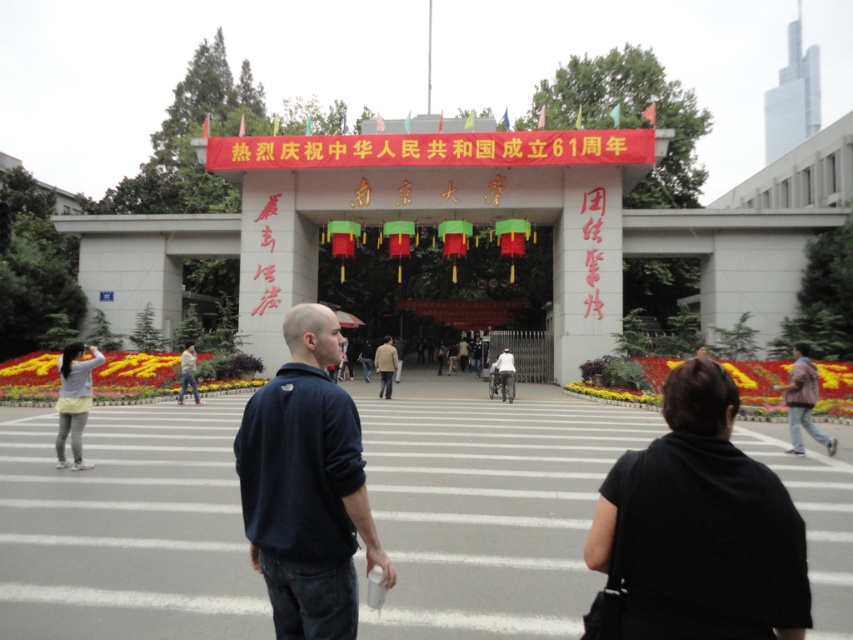
Question: Based on their relative distances, which object is nearer to the brown leather jacket at lower right?

Choices:
 (A) light brown leather jacket at center
 (B) dark blue fleece at center

Answer: (A)

Question: Which point appears closest to the camera in this image?

Choices:
 (A) (374, 362)
 (B) (329, 342)
 (C) (807, 400)

Answer: (B)

Question: Based on their relative distances, which object is farther from the light brown leather jacket at center?

Choices:
 (A) dark blue fleece at center
 (B) brown leather jacket at lower right

Answer: (A)

Question: Is dark blue fleece at center closer to the viewer compared to light brown leather jacket at center?

Choices:
 (A) yes
 (B) no

Answer: (A)

Question: Observing the image, what is the correct spatial positioning of dark blue fleece at center in reference to light brown leather jacket at center?

Choices:
 (A) right
 (B) left

Answer: (A)

Question: Is dark blue fleece at center behind light brown leather jacket at center?

Choices:
 (A) no
 (B) yes

Answer: (A)